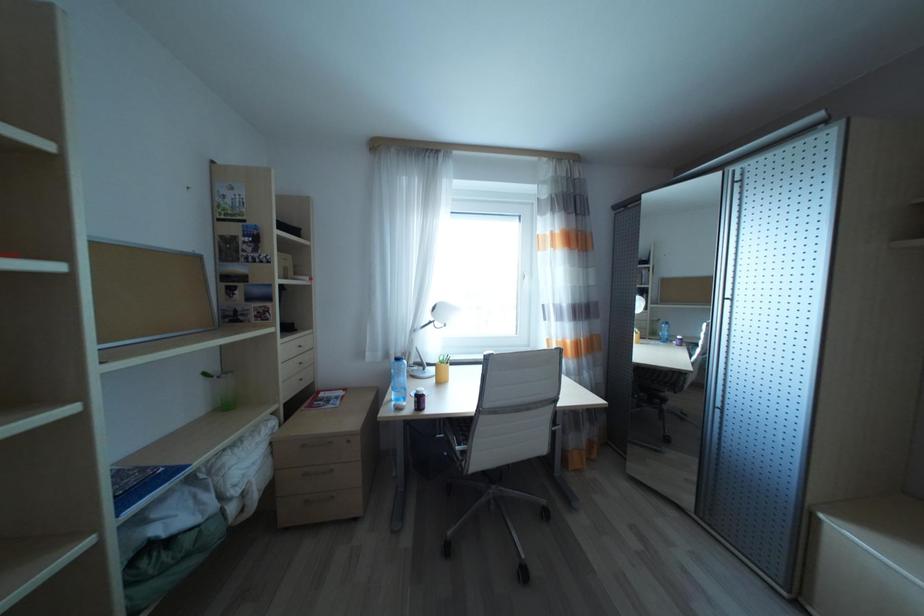
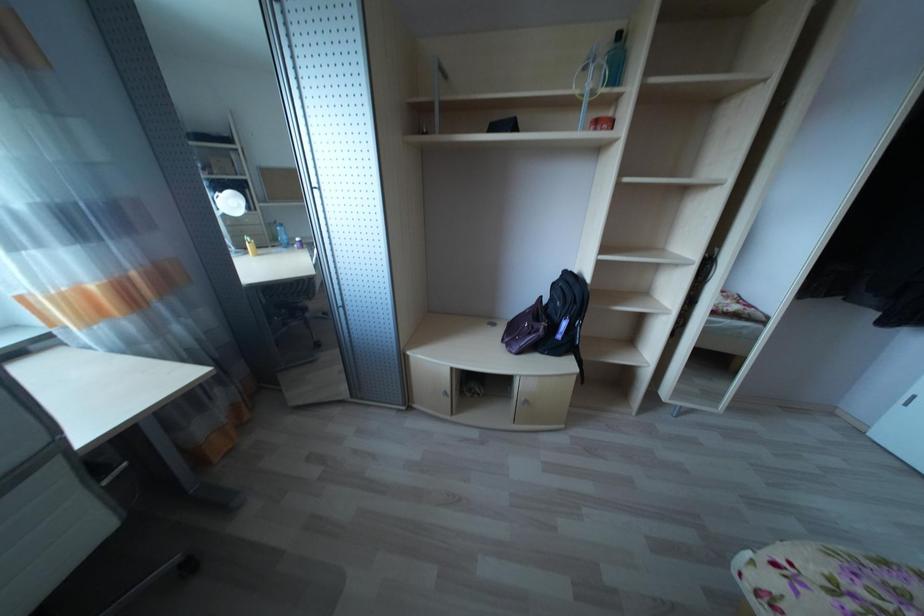
The first image is from the beginning of the video and the second image is from the end. How did the camera likely rotate when shooting the video?

The rotation direction of the camera is right-down.